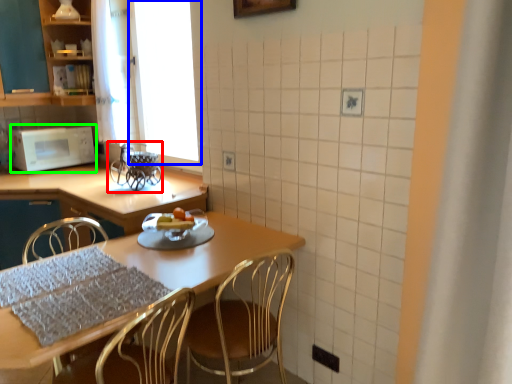
Question: Which object is positioned closest to appliance (highlighted by a red box)? Select from window screen (highlighted by a blue box) and microwave oven (highlighted by a green box).

Choices:
 (A) window screen
 (B) microwave oven

Answer: (B)